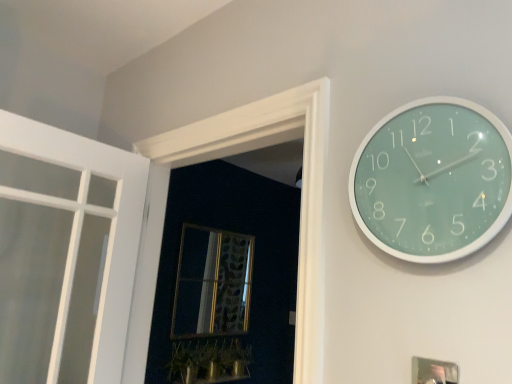
Question: From the image's perspective, would you say green glossy plant at lower center is shown under white wood frame at upper left?

Choices:
 (A) yes
 (B) no

Answer: (A)

Question: Is green glossy plant at lower center completely or partially outside of white wood frame at upper left?

Choices:
 (A) no
 (B) yes

Answer: (B)

Question: Is white wood frame at upper left completely or partially inside green glossy plant at lower center?

Choices:
 (A) no
 (B) yes

Answer: (A)

Question: Does green glossy plant at lower center come in front of white wood frame at upper left?

Choices:
 (A) yes
 (B) no

Answer: (B)

Question: Is green glossy plant at lower center facing away from white wood frame at upper left?

Choices:
 (A) no
 (B) yes

Answer: (A)

Question: From a real-world perspective, is green glossy plant at lower center located beneath white wood frame at upper left?

Choices:
 (A) no
 (B) yes

Answer: (B)

Question: Considering the relative sizes of metallic silver picture frame at lower right and gold-framed mirror at center in the image provided, is metallic silver picture frame at lower right smaller than gold-framed mirror at center?

Choices:
 (A) no
 (B) yes

Answer: (B)

Question: Can you confirm if metallic silver picture frame at lower right is bigger than gold-framed mirror at center?

Choices:
 (A) yes
 (B) no

Answer: (B)

Question: Is metallic silver picture frame at lower right not within gold-framed mirror at center?

Choices:
 (A) yes
 (B) no

Answer: (A)

Question: Is metallic silver picture frame at lower right not close to gold-framed mirror at center?

Choices:
 (A) yes
 (B) no

Answer: (A)

Question: Is metallic silver picture frame at lower right surrounding gold-framed mirror at center?

Choices:
 (A) yes
 (B) no

Answer: (B)

Question: From the image's perspective, does metallic silver picture frame at lower right appear lower than gold-framed mirror at center?

Choices:
 (A) no
 (B) yes

Answer: (A)

Question: Is gold-framed mirror at center shorter than teal glossy clock at upper right?

Choices:
 (A) no
 (B) yes

Answer: (A)